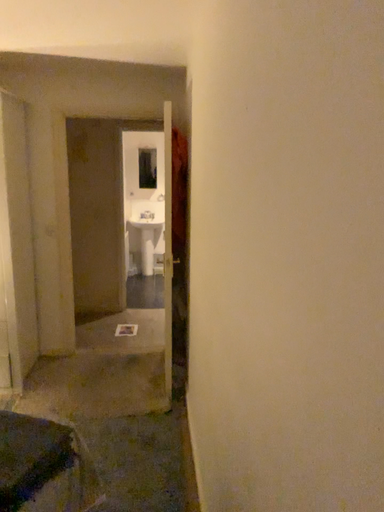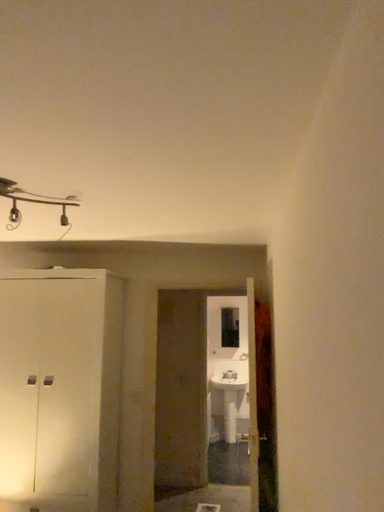
Question: How did the camera likely rotate when shooting the video?

Choices:
 (A) rotated upward
 (B) rotated downward

Answer: (A)